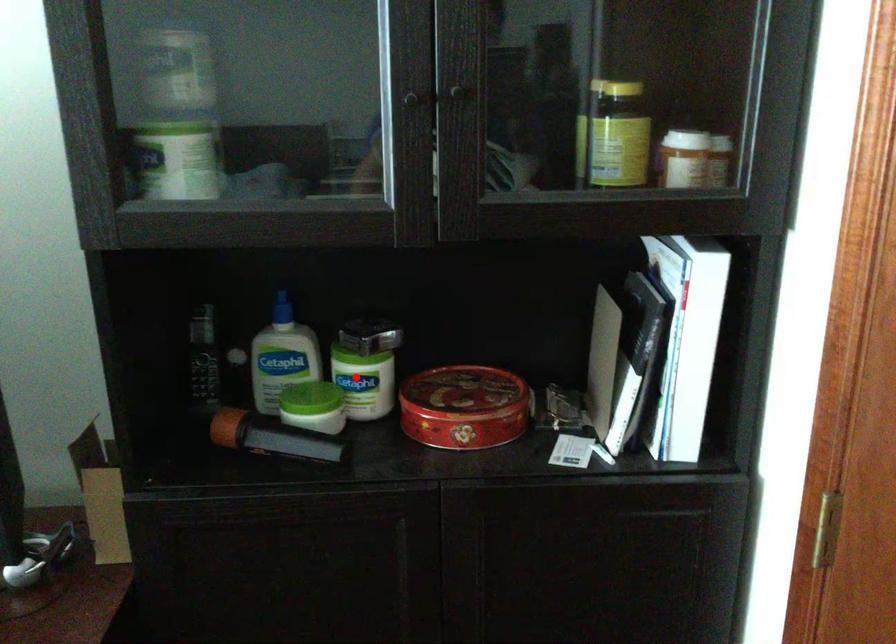
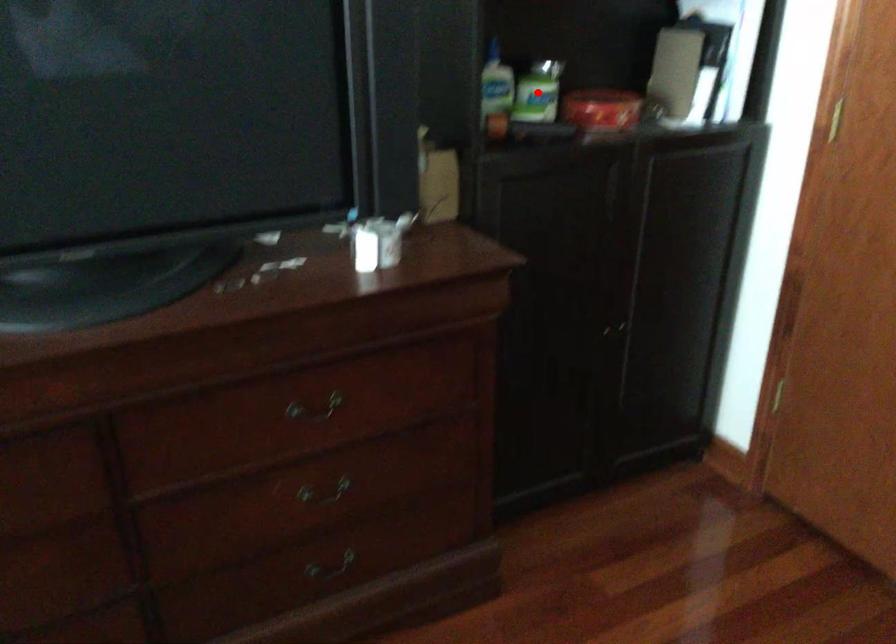
I am providing you with two images of the same scene from different viewpoints. A red point is marked on the first image and another point is marked on the second image. Are the points marked in image1 and image2 representing the same 3D position?

Yes